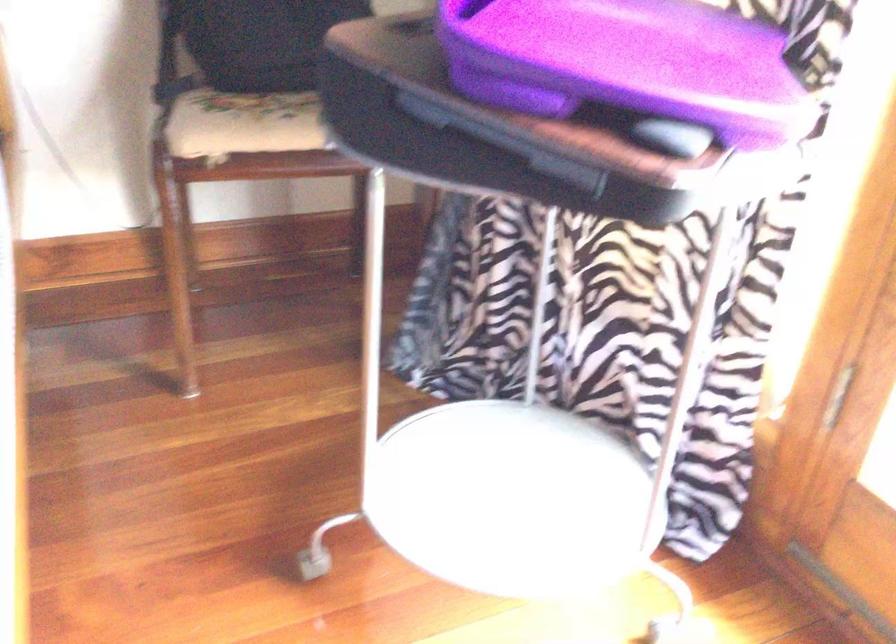
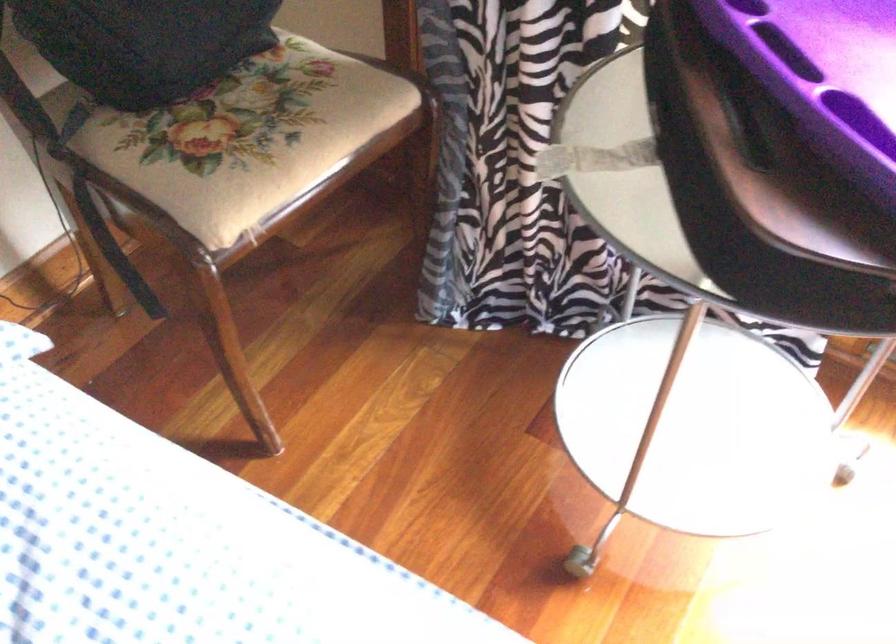
How did the camera likely rotate?

The camera rotated toward right-down.